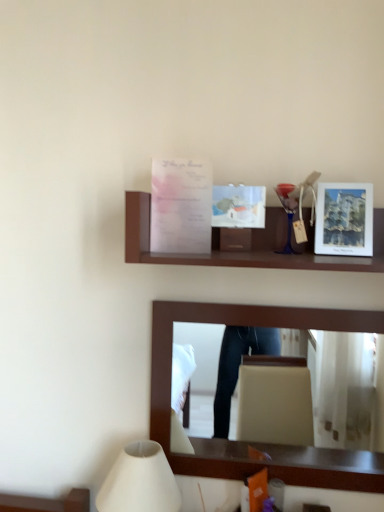
Question: Should I look upward or downward to see white matte lampshade at lower left?

Choices:
 (A) up
 (B) down

Answer: (B)

Question: Considering the relative sizes of white matte lampshade at lower left and brown wooden mirror at upper center in the image provided, is white matte lampshade at lower left wider than brown wooden mirror at upper center?

Choices:
 (A) no
 (B) yes

Answer: (B)

Question: From a real-world perspective, is white matte lampshade at lower left physically above brown wooden mirror at upper center?

Choices:
 (A) yes
 (B) no

Answer: (B)

Question: Is white matte lampshade at lower left oriented away from brown wooden mirror at upper center?

Choices:
 (A) no
 (B) yes

Answer: (B)

Question: From a real-world perspective, is white matte lampshade at lower left below brown wooden mirror at upper center?

Choices:
 (A) no
 (B) yes

Answer: (B)

Question: Can brown wooden mirror at upper center be found inside white matte lampshade at lower left?

Choices:
 (A) no
 (B) yes

Answer: (A)

Question: Considering the relative sizes of white matte lampshade at lower left and brown wooden mirror at upper center in the image provided, is white matte lampshade at lower left bigger than brown wooden mirror at upper center?

Choices:
 (A) no
 (B) yes

Answer: (A)

Question: Does brown wooden mirror at upper center turn towards translucent paper postcard at upper center?

Choices:
 (A) yes
 (B) no

Answer: (B)

Question: Is brown wooden mirror at upper center at the left side of translucent paper postcard at upper center?

Choices:
 (A) no
 (B) yes

Answer: (A)

Question: Is brown wooden mirror at upper center far from translucent paper postcard at upper center?

Choices:
 (A) yes
 (B) no

Answer: (B)

Question: From the image's perspective, would you say brown wooden mirror at upper center is positioned over translucent paper postcard at upper center?

Choices:
 (A) no
 (B) yes

Answer: (A)

Question: Can you confirm if brown wooden mirror at upper center is smaller than translucent paper postcard at upper center?

Choices:
 (A) yes
 (B) no

Answer: (B)

Question: Is brown wooden mirror at upper center further to the viewer compared to translucent paper postcard at upper center?

Choices:
 (A) no
 (B) yes

Answer: (B)

Question: Is translucent paper postcard at upper center facing towards matte white picture frame at right?

Choices:
 (A) yes
 (B) no

Answer: (B)